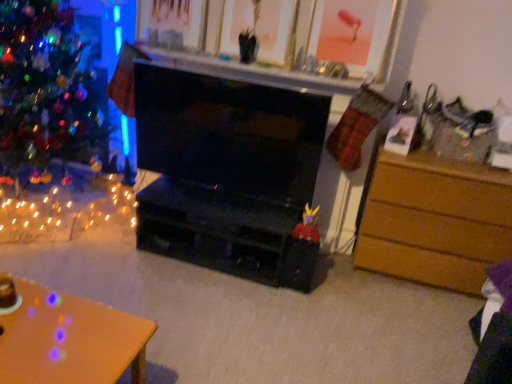
Locate an element on the screen. This screenshot has width=512, height=384. free location in front of brown wooden chest of drawers at right is located at coordinates (410, 321).